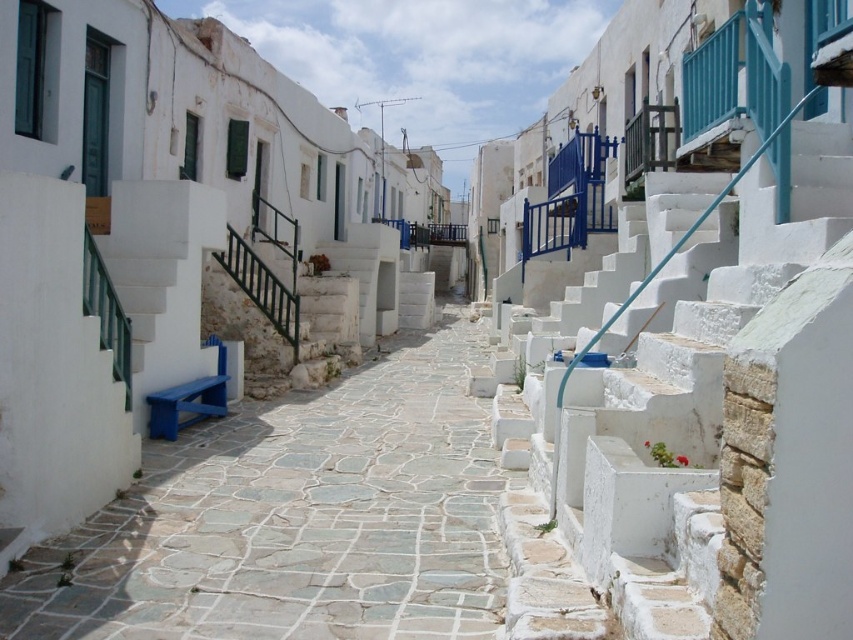
Is white stone stairs at upper right closer to camera compared to stone paved path at center?

Yes, it is in front of stone paved path at center.

Which of these two, white stone stairs at upper right or stone paved path at center, stands shorter?

stone paved path at center

Locate an element on the screen. white stone stairs at upper right is located at coordinates (697, 429).